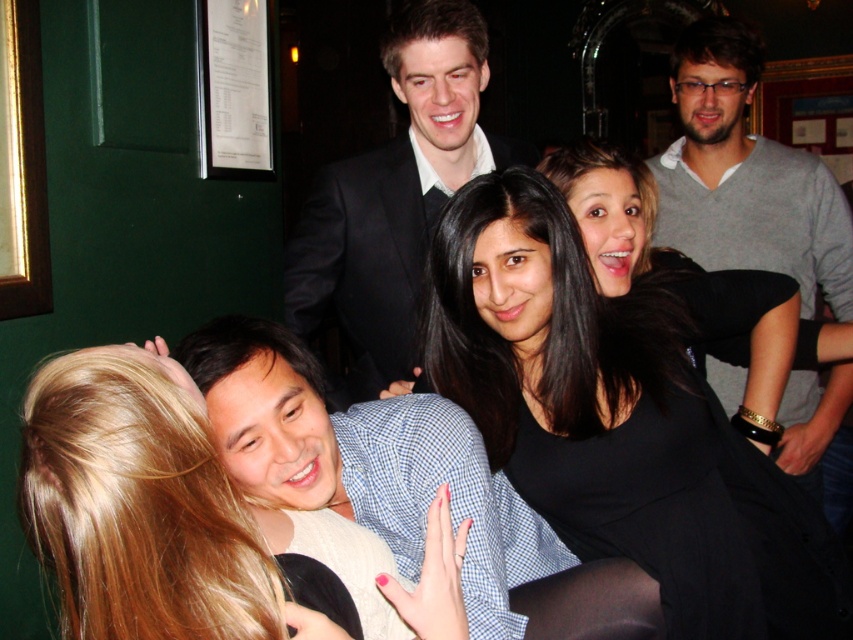
From the picture: You are a photographer setting up a shot for a group photo. You have a camera with a 1.5 meter wide lens. The black suit at center and the gray sweater at upper right are in your frame. Can you fit both subjects within the camera lens width without moving the camera?

The black suit at center might be wider than gray sweater at upper right, so it is uncertain if both can fit within the 1.5 meter lens width without moving the camera. The photographer should check the actual width of both subjects to ensure they fit.

What are the coordinates of the black matte dress at center?

The coordinates of the black matte dress at center are at point (621, 416).